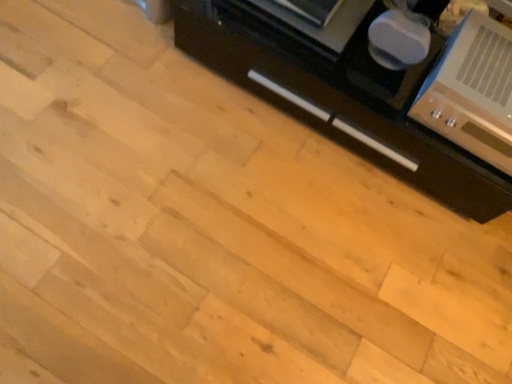
Question: Is metallic silver stereo at upper right not near black matte cabinet at right?

Choices:
 (A) no
 (B) yes

Answer: (A)

Question: From the image's perspective, is metallic silver stereo at upper right on top of black matte cabinet at right?

Choices:
 (A) no
 (B) yes

Answer: (A)

Question: Is metallic silver stereo at upper right positioned with its back to black matte cabinet at right?

Choices:
 (A) yes
 (B) no

Answer: (B)

Question: From a real-world perspective, is metallic silver stereo at upper right located higher than black matte cabinet at right?

Choices:
 (A) no
 (B) yes

Answer: (B)

Question: Is the depth of metallic silver stereo at upper right greater than that of black matte cabinet at right?

Choices:
 (A) no
 (B) yes

Answer: (A)

Question: Could black matte cabinet at right be considered to be inside metallic silver stereo at upper right?

Choices:
 (A) no
 (B) yes

Answer: (A)

Question: From the image's perspective, is black matte cabinet at right on metallic silver stereo at upper right?

Choices:
 (A) no
 (B) yes

Answer: (B)

Question: From a real-world perspective, is black matte cabinet at right located beneath metallic silver stereo at upper right?

Choices:
 (A) no
 (B) yes

Answer: (B)

Question: From a real-world perspective, is black matte cabinet at right positioned over metallic silver stereo at upper right based on gravity?

Choices:
 (A) yes
 (B) no

Answer: (B)

Question: Considering the relative sizes of black matte cabinet at right and metallic silver stereo at upper right in the image provided, is black matte cabinet at right thinner than metallic silver stereo at upper right?

Choices:
 (A) yes
 (B) no

Answer: (B)

Question: Can you confirm if black matte cabinet at right is wider than metallic silver stereo at upper right?

Choices:
 (A) no
 (B) yes

Answer: (B)

Question: Would you consider black matte cabinet at right to be distant from metallic silver stereo at upper right?

Choices:
 (A) no
 (B) yes

Answer: (A)

Question: Choose the correct answer: Is black matte cabinet at right inside metallic silver stereo at upper right or outside it?

Choices:
 (A) inside
 (B) outside

Answer: (B)